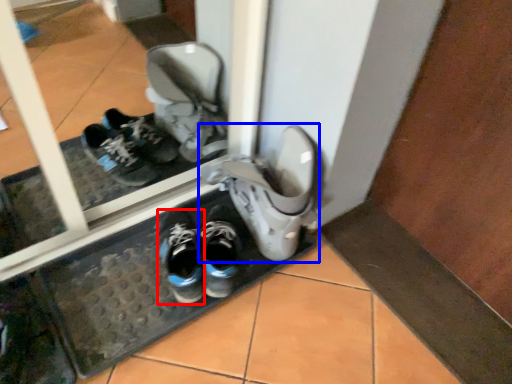
Question: Which object appears closest to the camera in this image, running shoe (highlighted by a red box) or footwear (highlighted by a blue box)?

Choices:
 (A) running shoe
 (B) footwear

Answer: (B)